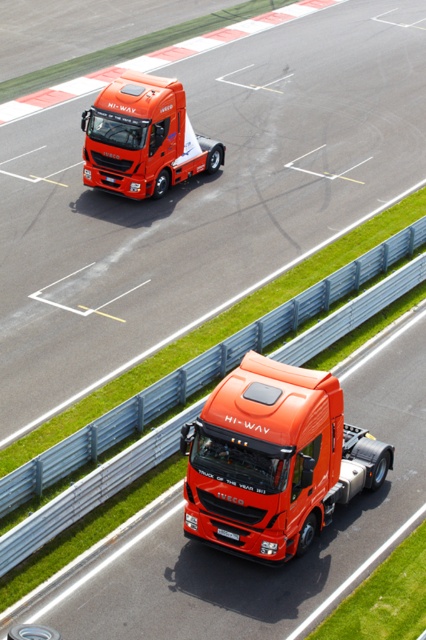
Question: Which point is farther to the camera?

Choices:
 (A) (155, 134)
 (B) (221, 529)

Answer: (A)

Question: Does matte orange truck at upper left have a smaller size compared to black plastic license plate at center?

Choices:
 (A) yes
 (B) no

Answer: (B)

Question: Is the position of shiny orange truck at center less distant than that of black plastic license plate at center?

Choices:
 (A) no
 (B) yes

Answer: (B)

Question: Which point is farther to the camera?

Choices:
 (A) shiny orange truck at center
 (B) black plastic license plate at center
 (C) matte orange truck at upper left

Answer: (C)

Question: Can you confirm if shiny orange truck at center is wider than black plastic license plate at center?

Choices:
 (A) no
 (B) yes

Answer: (B)

Question: Among these objects, which one is farthest from the camera?

Choices:
 (A) black plastic license plate at center
 (B) matte orange truck at upper left
 (C) shiny orange truck at center

Answer: (B)